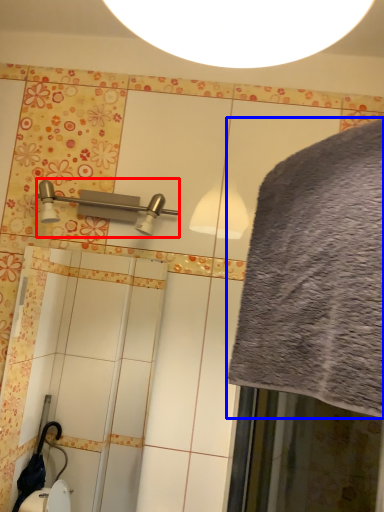
Question: Which point is closer to the camera, shower (highlighted by a red box) or bath towel (highlighted by a blue box)?

Choices:
 (A) shower
 (B) bath towel

Answer: (B)